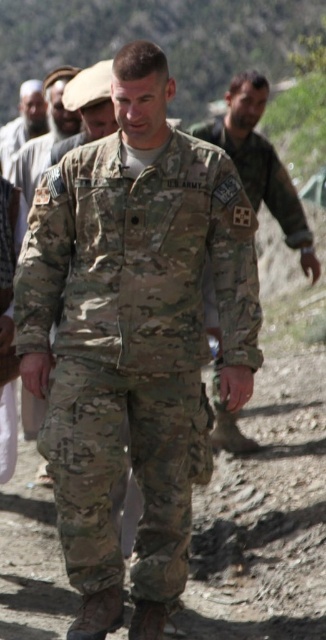
Question: Does camouflage fabric uniform at center have a larger size compared to dirt track at center?

Choices:
 (A) no
 (B) yes

Answer: (A)

Question: Can you confirm if dirt track at center is positioned below gray woolen cap at upper left?

Choices:
 (A) no
 (B) yes

Answer: (B)

Question: Which point is farther to the camera?

Choices:
 (A) (33, 77)
 (B) (46, 616)

Answer: (A)

Question: Among these objects, which one is nearest to the camera?

Choices:
 (A) gray woolen cap at upper left
 (B) camouflage uniform at center
 (C) dirt track at center
 (D) camouflage fabric uniform at center

Answer: (D)

Question: Is camouflage uniform at center in front of gray woolen cap at upper left?

Choices:
 (A) yes
 (B) no

Answer: (A)

Question: Which object appears closest to the camera in this image?

Choices:
 (A) camouflage fabric uniform at center
 (B) gray woolen cap at upper left
 (C) camouflage uniform at center
 (D) dirt track at center

Answer: (A)